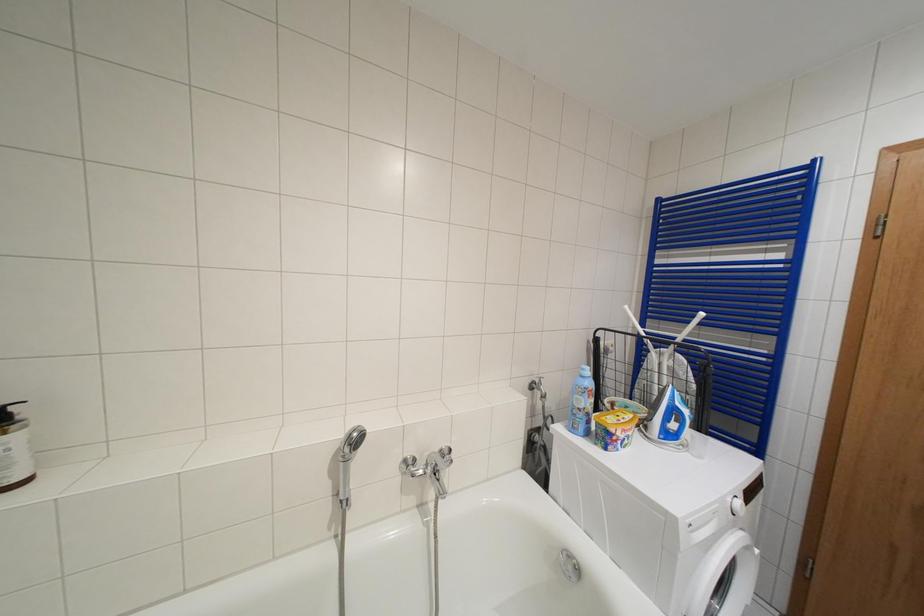
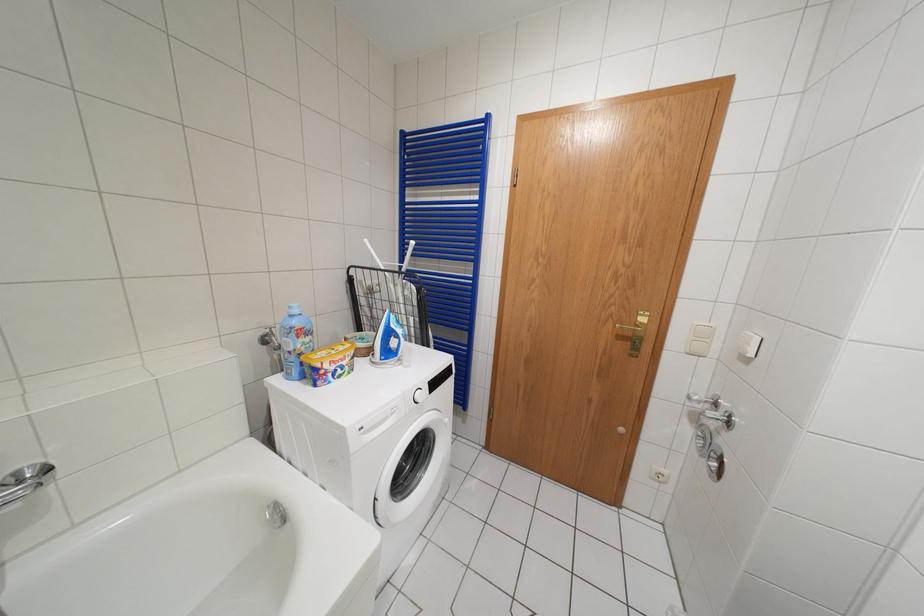
Question: The camera is either moving clockwise (left) or counter-clockwise (right) around the object. The first image is from the beginning of the video and the second image is from the end. Is the camera moving left or right when shooting the video?

Choices:
 (A) Left
 (B) Right

Answer: (A)